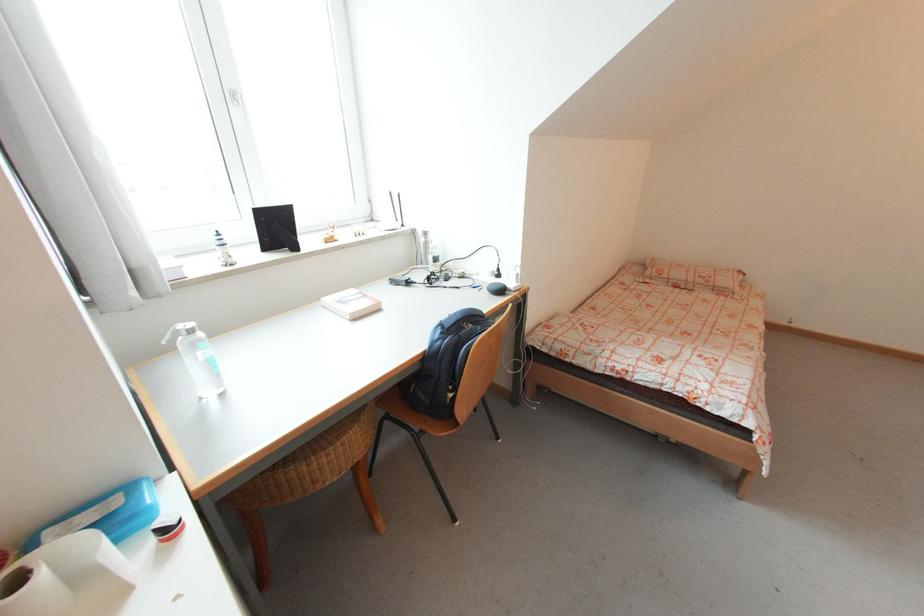
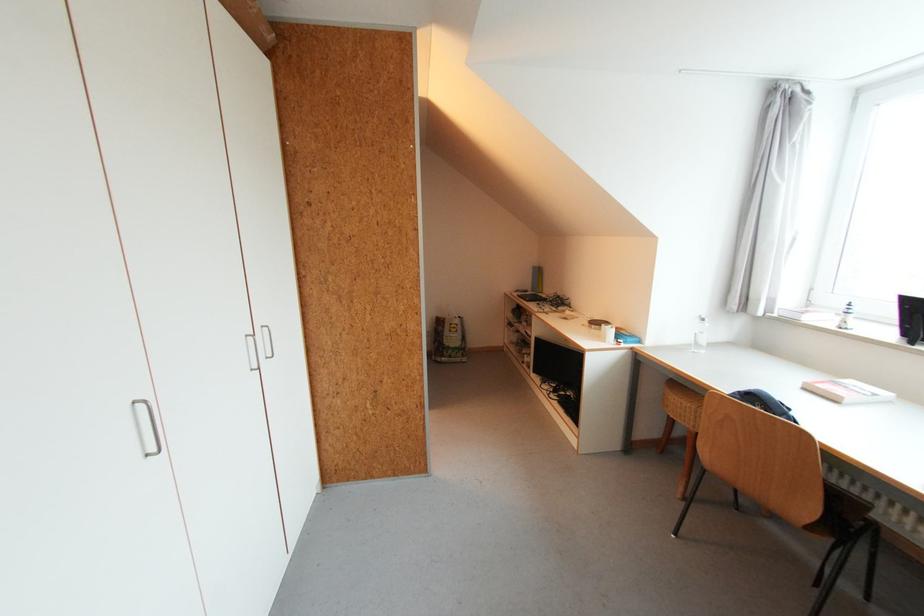
Find the pixel in the second image that matches pixel 383 310 in the first image.

(841, 403)